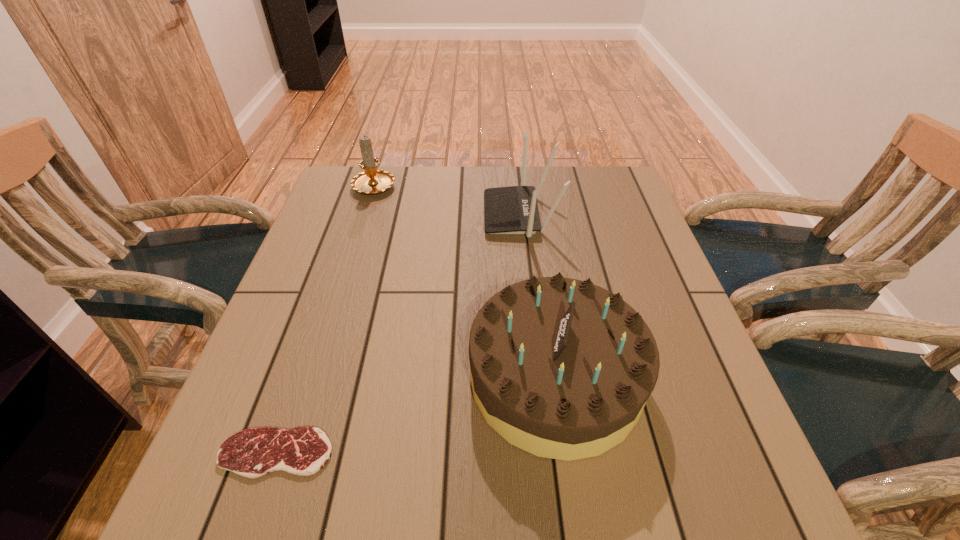
Find the location of `vacant space at the far edge of the desktop`. vacant space at the far edge of the desktop is located at coordinates (416, 176).

Locate an element on the screen. The height and width of the screenshot is (540, 960). free space at the near edge of the desktop is located at coordinates (359, 482).

Locate an element on the screen. Image resolution: width=960 pixels, height=540 pixels. blank space at the left edge of the desktop is located at coordinates (349, 272).

In the image, there is a desktop. Where is `vacant space at the right edge`? The width and height of the screenshot is (960, 540). vacant space at the right edge is located at coordinates (624, 273).

In the image, there is a desktop. At what (x,y) coordinates should I click in order to perform the action: click on vacant space at the far left corner. Please return your answer as a coordinate pair (x, y). The height and width of the screenshot is (540, 960). Looking at the image, I should click on (362, 210).

At what (x,y) coordinates should I click in order to perform the action: click on vacant area at the near left corner of the desktop. Please return your answer as a coordinate pair (x, y). The height and width of the screenshot is (540, 960). Looking at the image, I should click on (198, 496).

Locate an element on the screen. vacant point at the far right corner is located at coordinates (626, 196).

This screenshot has height=540, width=960. What are the coordinates of `free point between the steak and the candle` in the screenshot? It's located at (325, 319).

This screenshot has width=960, height=540. I want to click on vacant area that lies between the router and the candle, so click(x=447, y=200).

Image resolution: width=960 pixels, height=540 pixels. I want to click on blank region between the router and the candle, so click(x=447, y=200).